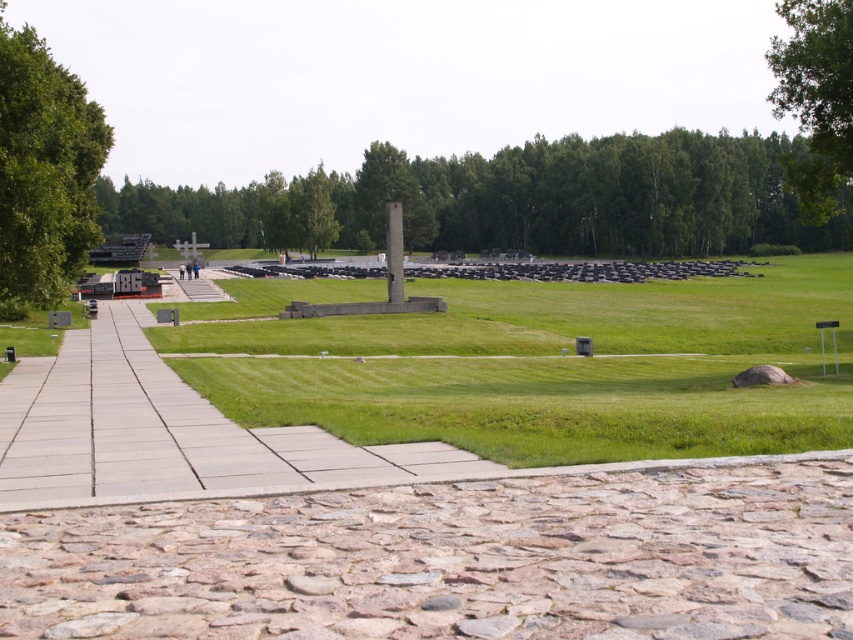
Question: Which object is the farthest from the green textured stone column at center?

Choices:
 (A) green leafy tree at upper right
 (B) gray concrete path at center

Answer: (B)

Question: Is green leafy tree at center smaller than green leafy tree at upper right?

Choices:
 (A) no
 (B) yes

Answer: (B)

Question: Is green leafy tree at center to the right of green leafy tree at upper right from the viewer's perspective?

Choices:
 (A) no
 (B) yes

Answer: (A)

Question: Considering the real-world distances, which object is closest to the green leafy tree at upper right?

Choices:
 (A) green leafy tree at left
 (B) gray concrete path at center

Answer: (A)

Question: Can you confirm if cobblestone pavement at lower center is positioned to the right of green textured stone column at center?

Choices:
 (A) no
 (B) yes

Answer: (B)

Question: Among these objects, which one is nearest to the camera?

Choices:
 (A) green leafy tree at left
 (B) cobblestone pavement at lower center
 (C) smooth concrete column at center

Answer: (B)